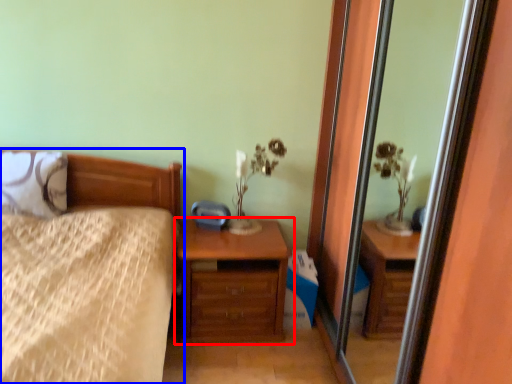
Question: Which object appears farthest to the camera in this image, chest of drawers (highlighted by a red box) or bed (highlighted by a blue box)?

Choices:
 (A) chest of drawers
 (B) bed

Answer: (A)